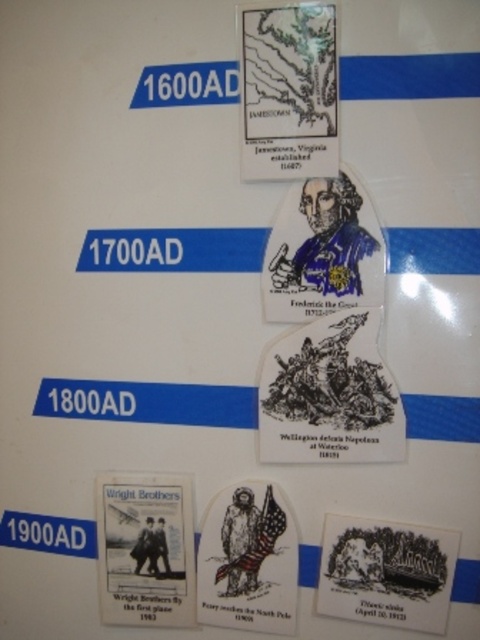
Consider the image. You are standing in front of the timeline and want to touch the point at coordinate point (109, 508). If your arm can reach up to 1 meter, can you reach it?

The distance between you and point (109, 508) is 1.08 meters, which is slightly beyond your arm reach of 1 meter. You cannot reach it.

Based on the scene description, what is the relationship in size between the white paper wright brothers poster at lower left and the white paper flag at lower center?

The white paper wright brothers poster at lower left is much taller than the white paper flag at lower center.

What is the relationship in size between the black ink drawing of a scene at lower right and the white paper flag at lower center in the 1700AD section?

The black ink drawing of a scene at lower right is bigger than the white paper flag at lower center.